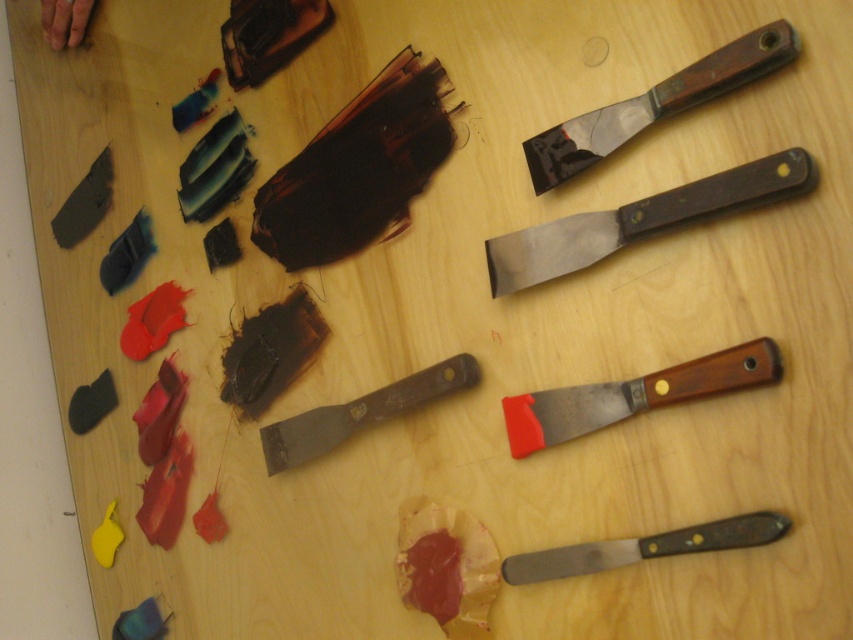
You are an artist working on a project that requires precise measurements. You have two points on your table where you need to place tools. The first point is at coordinate point (444, 376), and the second point is somewhere else on the table. If the distance between these two points is exactly 33.81 inches, can you confirm whether the second point is within the boundaries of the table?

The distance between the two points is 33.81 inches, but without knowing the table dimensions, it is impossible to determine if the second point is within the table boundaries.